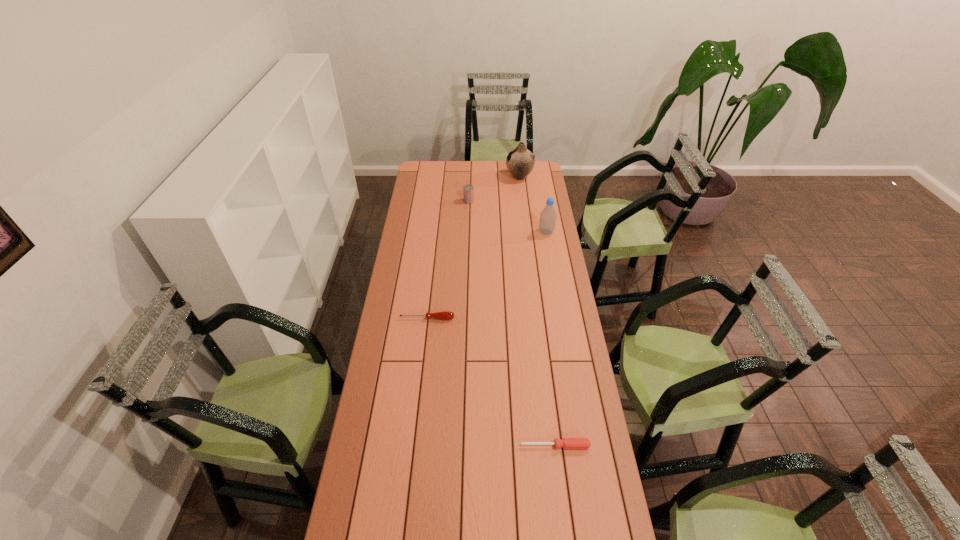
Image resolution: width=960 pixels, height=540 pixels. I want to click on object at the far right corner, so click(x=520, y=161).

You are a GUI agent. You are given a task and a screenshot of the screen. Output one action in this format:
    pyautogui.click(x=<x>, y=<y>)
    Task: Click on the free space at the far edge
    This screenshot has height=540, width=960.
    Given the screenshot: What is the action you would take?
    pyautogui.click(x=492, y=174)

Identify the location of vacant space at the left edge. The image size is (960, 540). click(410, 366).

I want to click on vacant space at the right edge, so click(x=560, y=369).

The height and width of the screenshot is (540, 960). Find the location of `vacant space at the far left corner of the desktop`. vacant space at the far left corner of the desktop is located at coordinates (438, 165).

Find the location of `blank region between the left screwdriver and the second object from left to right`. blank region between the left screwdriver and the second object from left to right is located at coordinates (448, 260).

This screenshot has height=540, width=960. Identify the location of vacant space that's between the third farthest object and the beer can. (508, 217).

Locate an element on the screen. The width and height of the screenshot is (960, 540). unoccupied position between the nearer screwdriver and the third tallest object is located at coordinates (512, 323).

At what (x,y) coordinates should I click in order to perform the action: click on empty space between the nearer screwdriver and the farthest object. Please return your answer as a coordinate pair (x, y). This screenshot has width=960, height=540. Looking at the image, I should click on (538, 311).

Identify the location of empty space that is in between the nearest object and the farthest object. (538, 311).